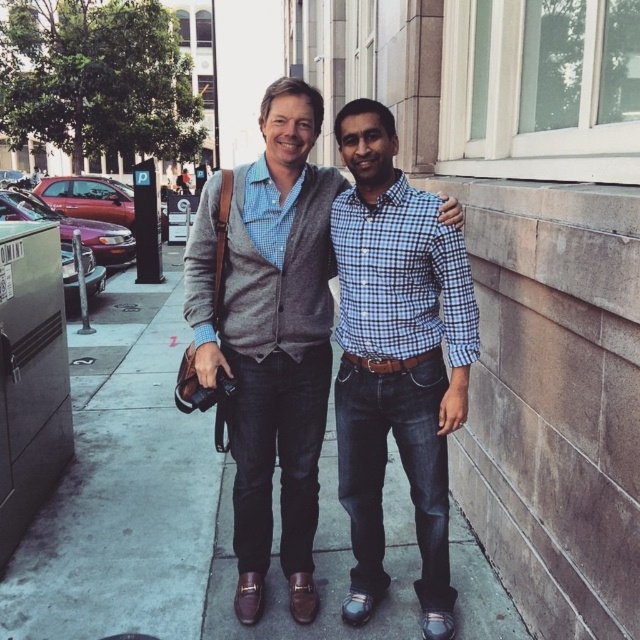
Question: Does dark gray concrete sidewalk at center have a lesser width compared to matte gray sweater at center?

Choices:
 (A) no
 (B) yes

Answer: (A)

Question: Can you confirm if dark gray concrete sidewalk at center is wider than matte gray sweater at center?

Choices:
 (A) yes
 (B) no

Answer: (A)

Question: Which of these objects is positioned closest to the blue checkered shirt at center?

Choices:
 (A) matte gray sweater at center
 (B) dark gray concrete sidewalk at center

Answer: (A)

Question: Is matte gray sweater at center above blue checkered shirt at center?

Choices:
 (A) no
 (B) yes

Answer: (B)

Question: Which point appears closest to the camera in this image?

Choices:
 (A) (332, 406)
 (B) (301, 284)

Answer: (B)

Question: Which is farther from the matte gray sweater at center?

Choices:
 (A) dark gray concrete sidewalk at center
 (B) blue checkered shirt at center

Answer: (A)